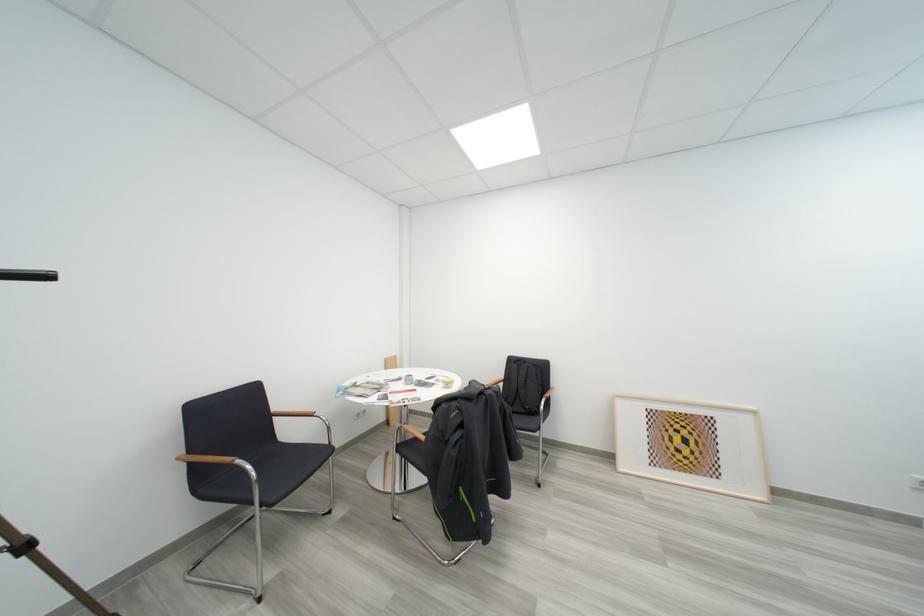
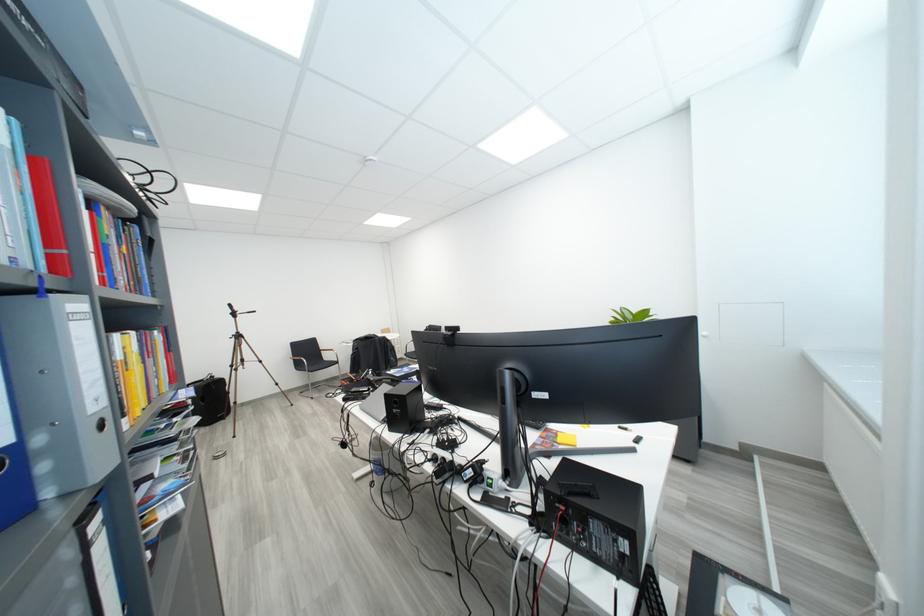
In a continuous first-person perspective shot, in which direction is the camera moving?

The cameraman moved toward right, backward.